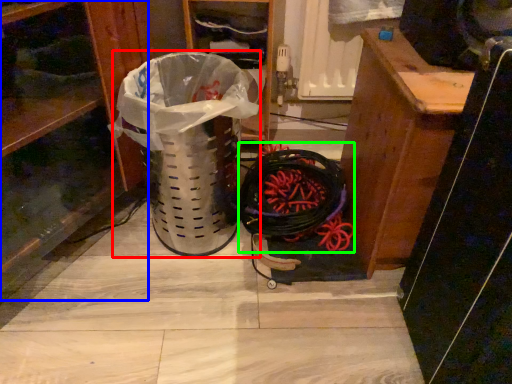
Question: Which is nearer to the garbage (highlighted by a red box)? shelf (highlighted by a blue box) or battle rope (highlighted by a green box).

Choices:
 (A) shelf
 (B) battle rope

Answer: (A)